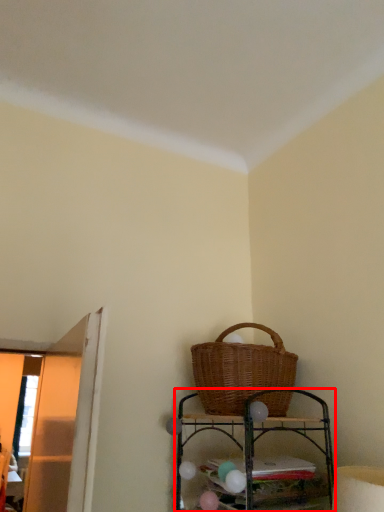
Question: From the image's perspective, where is shelf (annotated by the red box) located relative to picnic basket?

Choices:
 (A) below
 (B) above

Answer: (A)